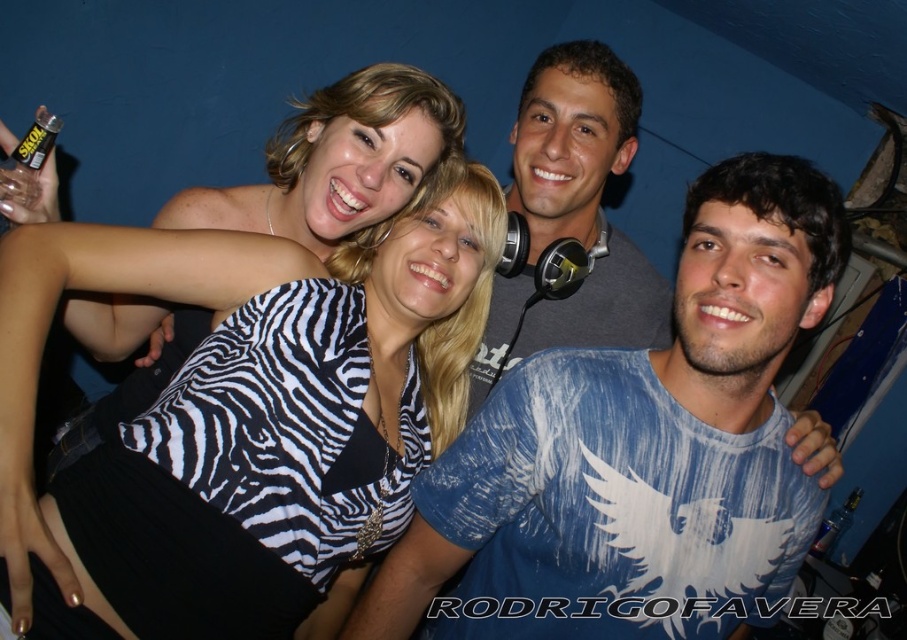
Between blue cotton t-shirt at center and clear plastic bottle at lower right, which one is positioned lower?

clear plastic bottle at lower right is below.

Who is more distant from viewer, (x=483, y=634) or (x=808, y=548)?

Point (x=808, y=548)

Where is `blue cotton t-shirt at center`? The image size is (907, 640). blue cotton t-shirt at center is located at coordinates (642, 428).

Which is above, zebra print top at center or transparent plastic bottle at upper left?

transparent plastic bottle at upper left

Which is behind, point (286, 308) or point (17, 161)?

The point (286, 308) is more distant.

In the scene shown: Who is more distant from viewer, [239,566] or [0,129]?

The point [239,566] is behind.

Where is `zebra print top at center`? The width and height of the screenshot is (907, 640). zebra print top at center is located at coordinates pos(240,422).

Which is behind, point (690, 528) or point (28, 202)?

Positioned behind is point (690, 528).

Does blue cotton t-shirt at center have a greater width compared to transparent plastic bottle at upper left?

Yes, blue cotton t-shirt at center is wider than transparent plastic bottle at upper left.

Locate an element on the screen. blue cotton t-shirt at center is located at coordinates (642, 428).

Identify the location of blue cotton t-shirt at center. (642, 428).